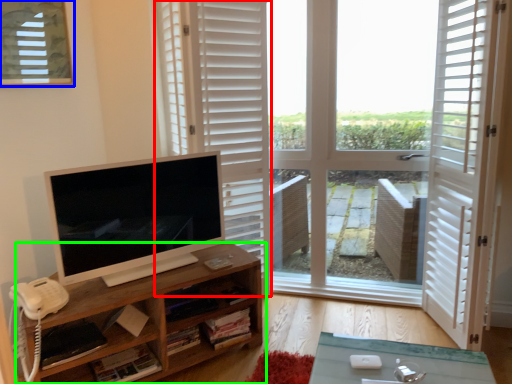
Question: Which object is positioned closest to curtain (highlighted by a red box)? Select from window (highlighted by a blue box) and shelf (highlighted by a green box).

Choices:
 (A) window
 (B) shelf

Answer: (A)